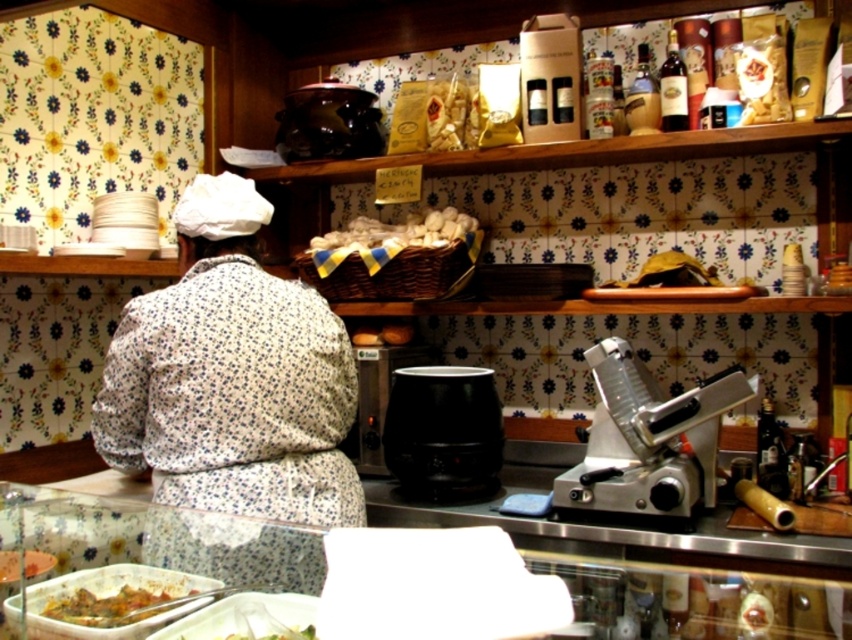
Between point (199, 364) and point (105, 563), which one is positioned behind?

The point (199, 364) is behind.

Is white floral apron at center smaller than stainless steel counter at center?

No, white floral apron at center is not smaller than stainless steel counter at center.

Is point (246, 237) closer to camera compared to point (193, 532)?

No, (246, 237) is further to viewer.

Identify the location of white floral apron at center. (232, 403).

Does white fluffy bread at center appear under green leafy vegetable at lower center?

Incorrect, white fluffy bread at center is not positioned below green leafy vegetable at lower center.

What do you see at coordinates (398, 230) in the screenshot? I see `white fluffy bread at center` at bounding box center [398, 230].

I want to click on white fluffy bread at center, so click(398, 230).

Who is lower down, stainless steel counter at center or green leafy vegetable at lower center?

Positioned lower is stainless steel counter at center.

Is point (246, 561) positioned in front of point (291, 630)?

No.

The height and width of the screenshot is (640, 852). What are the coordinates of `stainless steel counter at center` in the screenshot? It's located at (694, 600).